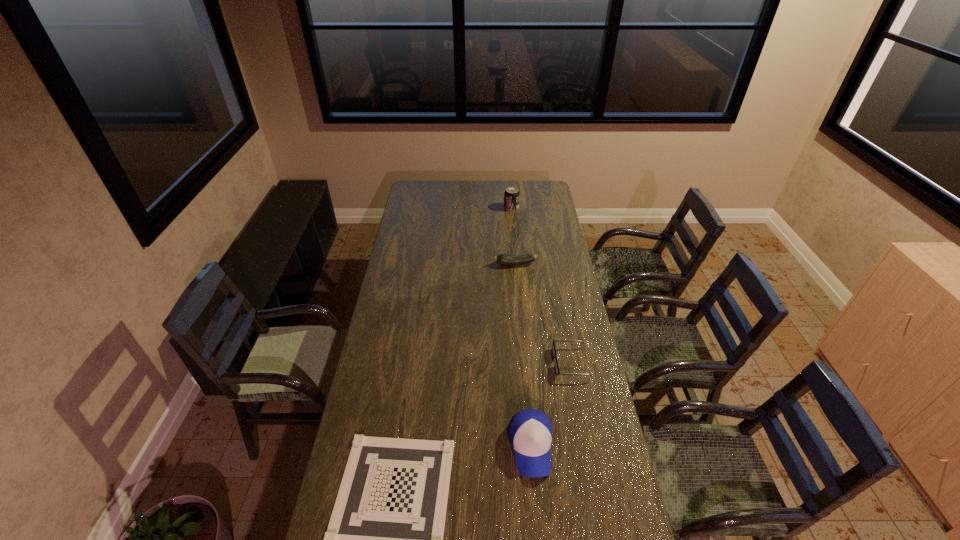
Image resolution: width=960 pixels, height=540 pixels. I want to click on the tallest object, so click(511, 196).

Where is `soda can`? Image resolution: width=960 pixels, height=540 pixels. soda can is located at coordinates (511, 196).

Find the location of `the fourth shortest object`. the fourth shortest object is located at coordinates (530, 431).

In order to click on the second farthest object in this screenshot , I will do `click(503, 259)`.

This screenshot has height=540, width=960. I want to click on zucchini, so click(503, 259).

Locate an element on the screen. spectacles is located at coordinates click(x=557, y=371).

You are a GUI agent. You are given a task and a screenshot of the screen. Output one action in this format:
    pyautogui.click(x=<x>, y=<y>)
    Task: Click on the third farthest object
    The height and width of the screenshot is (540, 960).
    Given the screenshot: What is the action you would take?
    pyautogui.click(x=557, y=371)

Locate an element on the screen. The width and height of the screenshot is (960, 540). free location located 0.120m on the left of the soda can is located at coordinates (484, 207).

I want to click on vacant point located 0.070m on the front-facing side of the baseball cap, so click(x=537, y=504).

Find the location of a particular element. The image size is (960, 540). free space located 0.090m at the blossom end of the second farthest object is located at coordinates (475, 264).